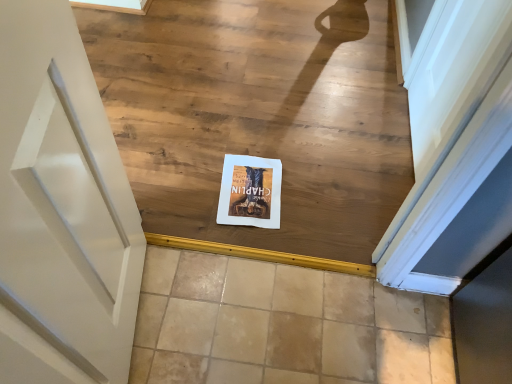
Measure the distance between beige tile at center and camera.

1.11 meters.

Image resolution: width=512 pixels, height=384 pixels. I want to click on matte paper postcard at center, so click(x=250, y=192).

From the image's perspective, is matte paper postcard at center positioned above or below beige tile at center?

matte paper postcard at center is situated higher than beige tile at center in the image.

Is matte paper postcard at center turned away from beige tile at center?

Yes, matte paper postcard at center is facing away from beige tile at center.

How far apart are matte paper postcard at center and beige tile at center?

matte paper postcard at center is 12.75 inches from beige tile at center.

Is beige tile at center inside the boundaries of matte paper postcard at center, or outside?

The correct answer is: outside.

From a real-world perspective, is beige tile at center physically located above or below matte paper postcard at center?

Clearly, from a real-world perspective, beige tile at center is below matte paper postcard at center.

Who is taller, beige tile at center or matte paper postcard at center?

beige tile at center.

Identify the location of postcard on the left of beige tile at center. (250, 192).

Which of these two, beige tile at center or white paper at center, is smaller?

Smaller between the two is beige tile at center.

Which object is more forward, beige tile at center or white paper at center?

beige tile at center.

Is beige tile at center oriented towards white paper at center?

No, beige tile at center is not facing towards white paper at center.

Between white paper at center and matte paper postcard at center, which one has smaller size?

With smaller size is matte paper postcard at center.

Is white paper at center far away from matte paper postcard at center?

white paper at center is near matte paper postcard at center, not far away.

Does white paper at center appear on the right side of matte paper postcard at center?

In fact, white paper at center is to the left of matte paper postcard at center.

In the scene shown: Can you tell me how much matte paper postcard at center and white paper at center differ in facing direction?

They differ by 175 degrees in their facing directions.

How far apart are matte paper postcard at center and white paper at center?

matte paper postcard at center and white paper at center are 32.72 centimeters apart from each other.

Based on the photo, from a real-world perspective, is matte paper postcard at center beneath white paper at center?

Yes, from a real-world perspective, matte paper postcard at center is under white paper at center.

Is matte paper postcard at center outside of white paper at center?

No.

From a real-world perspective, is white paper at center under beige tile at center?

Actually, white paper at center is physically above beige tile at center in the real world.

From the image's perspective, is white paper at center over beige tile at center?

Yes, from the image's perspective, white paper at center is above beige tile at center.

Considering the positions of objects white paper at center and beige tile at center in the image provided, who is more to the left, white paper at center or beige tile at center?

white paper at center is more to the left.

Between white paper at center and beige tile at center, which one has more height?

Standing taller between the two is white paper at center.

You are a GUI agent. You are given a task and a screenshot of the screen. Output one action in this format:
    pyautogui.click(x=<x>, y=<y>)
    Task: Click on the postcard on the left of beige tile at center
    This screenshot has height=384, width=512.
    Given the screenshot: What is the action you would take?
    pyautogui.click(x=250, y=192)

What are the coordinates of `tile below the matte paper postcard at center (from the image's perspective)` in the screenshot? It's located at (281, 325).

Looking at the image, which one is located further to matte paper postcard at center, beige tile at center or white paper at center?

white paper at center lies further to matte paper postcard at center than the other object.

Looking at the image, which one is located further to beige tile at center, matte paper postcard at center or white paper at center?

The object further to beige tile at center is white paper at center.

Which object lies nearer to the anchor point matte paper postcard at center, white paper at center or beige tile at center?

beige tile at center is closer to matte paper postcard at center.

Looking at the image, which one is located further to white paper at center, beige tile at center or matte paper postcard at center?

The object further to white paper at center is beige tile at center.

From the image, which object appears to be nearer to white paper at center, matte paper postcard at center or beige tile at center?

The object closer to white paper at center is matte paper postcard at center.

Which object lies nearer to the anchor point beige tile at center, white paper at center or matte paper postcard at center?

matte paper postcard at center.

The image size is (512, 384). I want to click on postcard that lies between white paper at center and beige tile at center from top to bottom, so click(x=250, y=192).